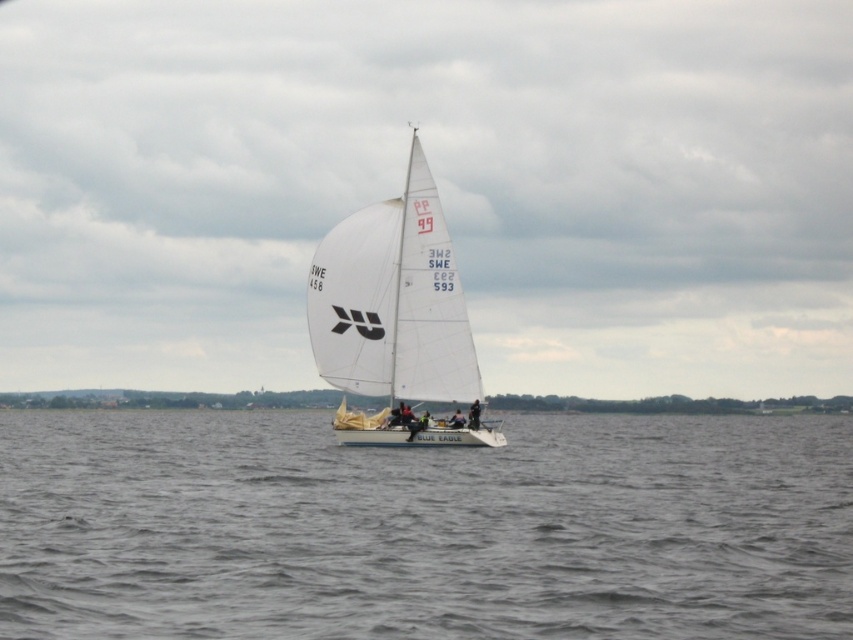
Question: Among these points, which one is farthest from the camera?

Choices:
 (A) (212, 417)
 (B) (401, 392)

Answer: (A)

Question: Is gray water at center bigger than white matte sailboat at center?

Choices:
 (A) no
 (B) yes

Answer: (B)

Question: Which point is farther from the camera taking this photo?

Choices:
 (A) (433, 269)
 (B) (357, 481)

Answer: (A)

Question: Can you confirm if gray water at center is smaller than white matte sailboat at center?

Choices:
 (A) yes
 (B) no

Answer: (B)

Question: Does gray water at center come in front of white matte sailboat at center?

Choices:
 (A) yes
 (B) no

Answer: (A)